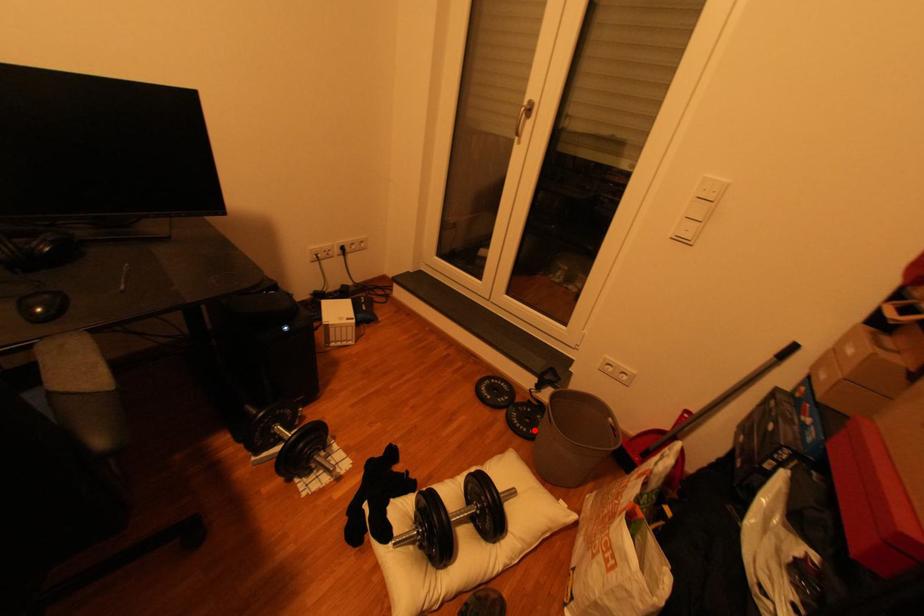
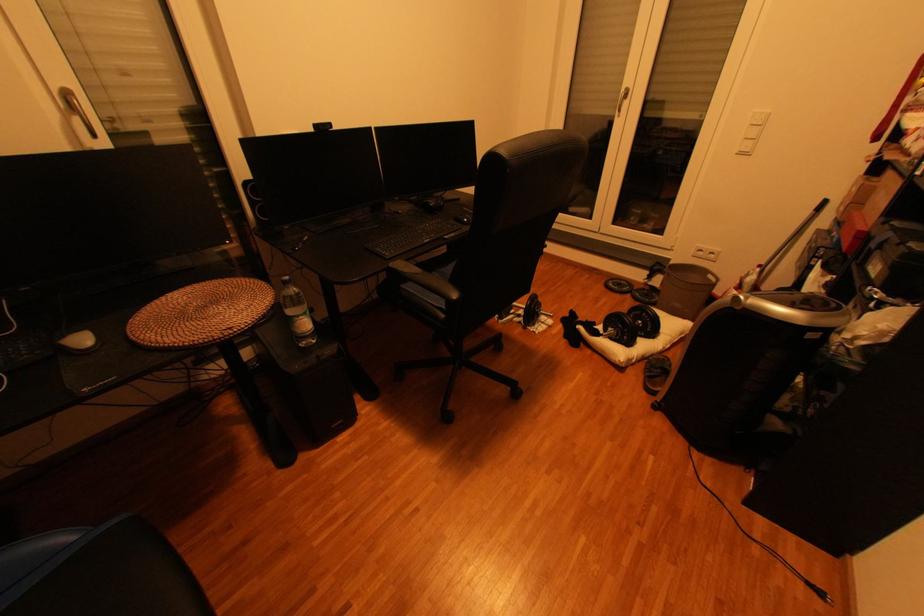
Locate, in the second image, the point that corresponds to the highlighted location in the first image.

(658, 301)